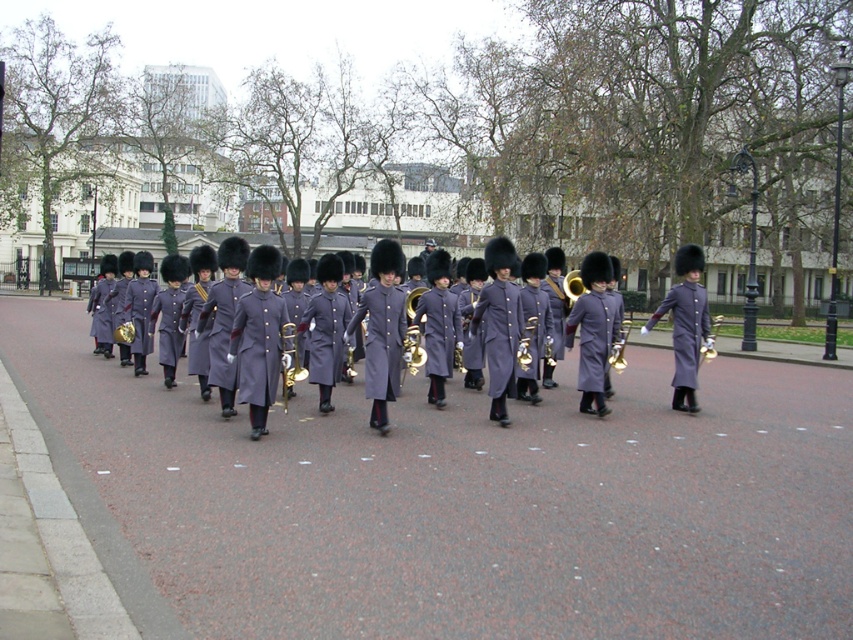
You are a photographer positioned on the sidewalk, wanting to capture both the gold brass trombone at center and the brass polished trumpet at center in a single frame. Which instrument should you focus on first to ensure both are in the frame?

The gold brass trombone at center is shorter than the brass polished trumpet at center, so you should focus on the brass polished trumpet at center first to ensure both are in the frame since it is taller and requires more vertical space.

You are a photographer standing on the sidewalk observing the military band. You want to take a photo that captures both the gold brass trombone at center and the brass polished trumpet at center. Which instrument will appear closer to the camera in the photo?

The gold brass trombone at center will appear closer to the camera in the photo because it is positioned in front of the brass polished trumpet at center.

From the picture: You are a photographer positioned on the sidewalk, and you want to capture a photo that includes both the matte purple uniform at center and the brass polished tuba at center. Which object should you focus on first if you want to ensure both are in frame without moving the camera?

The matte purple uniform at center is wider than the brass polished tuba at center. To ensure both are in frame, focus on the wider matte purple uniform at center first, then adjust the camera angle slightly to include the narrower brass polished tuba at center.